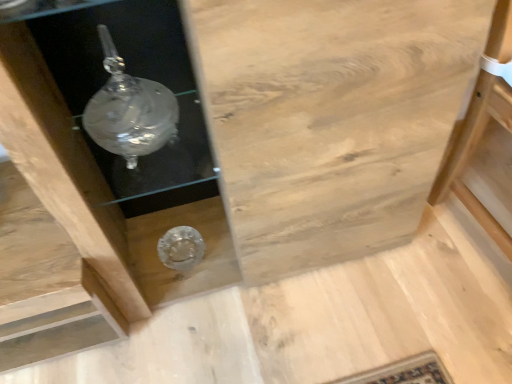
Question: From the image's perspective, would you say natural wood table at right is shown under natural wood cabinet at center?

Choices:
 (A) no
 (B) yes

Answer: (B)

Question: Can you confirm if natural wood table at right is positioned to the left of natural wood cabinet at center?

Choices:
 (A) yes
 (B) no

Answer: (B)

Question: Are natural wood table at right and natural wood cabinet at center located far from each other?

Choices:
 (A) no
 (B) yes

Answer: (A)

Question: Are natural wood table at right and natural wood cabinet at center beside each other?

Choices:
 (A) yes
 (B) no

Answer: (B)

Question: Is natural wood table at right to the right of natural wood cabinet at center from the viewer's perspective?

Choices:
 (A) no
 (B) yes

Answer: (B)

Question: Is natural wood table at right looking in the opposite direction of natural wood cabinet at center?

Choices:
 (A) no
 (B) yes

Answer: (A)

Question: Can natural wood table at right be found inside natural wood cabinet at center?

Choices:
 (A) yes
 (B) no

Answer: (B)

Question: Is natural wood cabinet at center directly adjacent to natural wood table at right?

Choices:
 (A) no
 (B) yes

Answer: (A)

Question: Can you confirm if natural wood cabinet at center is thinner than natural wood table at right?

Choices:
 (A) yes
 (B) no

Answer: (A)

Question: Is natural wood cabinet at center outside natural wood table at right?

Choices:
 (A) yes
 (B) no

Answer: (A)

Question: Is natural wood cabinet at center further to the viewer compared to natural wood table at right?

Choices:
 (A) yes
 (B) no

Answer: (B)

Question: Considering the relative sizes of natural wood cabinet at center and natural wood table at right in the image provided, is natural wood cabinet at center taller than natural wood table at right?

Choices:
 (A) yes
 (B) no

Answer: (A)

Question: Is natural wood cabinet at center to the left or to the right of natural wood table at right in the image?

Choices:
 (A) left
 (B) right

Answer: (A)